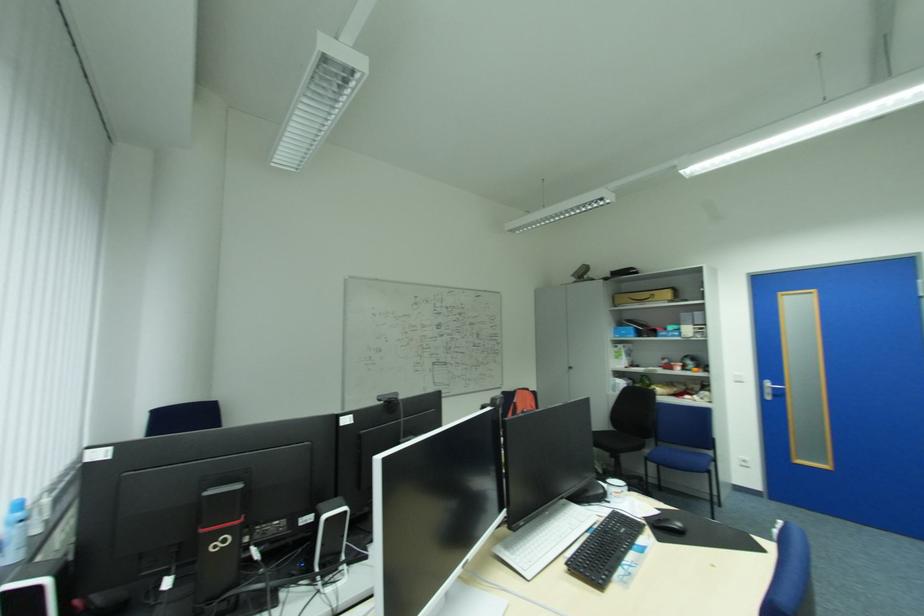
Where is `black computer mouse`? The image size is (924, 616). black computer mouse is located at coordinates (666, 525).